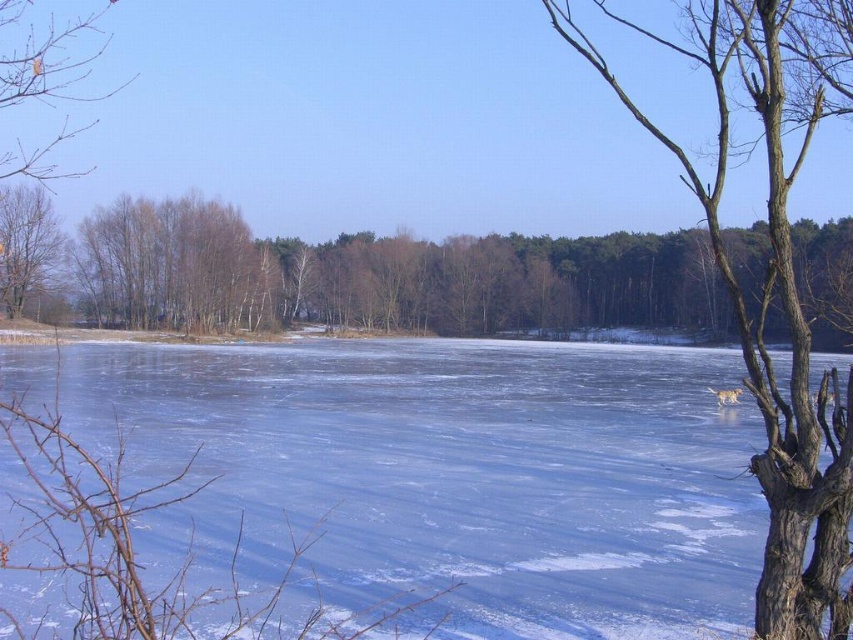
This screenshot has height=640, width=853. What do you see at coordinates (347, 273) in the screenshot? I see `brown bark tree at center` at bounding box center [347, 273].

Can you confirm if brown bark tree at center is taller than brown leafless branch at upper left?

No, brown bark tree at center is not taller than brown leafless branch at upper left.

Between point (379, 285) and point (56, 134), which one is positioned behind?

Point (56, 134)

Locate an element on the screen. The image size is (853, 640). brown bark tree at center is located at coordinates (347, 273).

Who is higher up, brown leafless branch at upper left or smooth brown tree trunk at left?

Positioned higher is brown leafless branch at upper left.

Does point (44, 54) come farther from viewer compared to point (54, 269)?

Yes, point (44, 54) is behind point (54, 269).

The image size is (853, 640). Identify the location of brown leafless branch at upper left. (50, 65).

Does smooth bark tree at right come in front of brown leafless branch at upper left?

Yes, smooth bark tree at right is closer to the viewer.

Which is above, smooth bark tree at right or brown leafless branch at upper left?

brown leafless branch at upper left is above.

The image size is (853, 640). Find the location of `smooth bark tree at right`. smooth bark tree at right is located at coordinates (x=763, y=340).